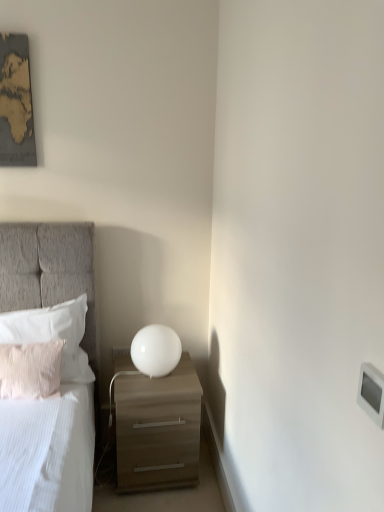
The width and height of the screenshot is (384, 512). What do you see at coordinates (156, 350) in the screenshot?
I see `white glossy sphere at center` at bounding box center [156, 350].

What is the approximate height of white glossy sphere at center?

white glossy sphere at center is 9.19 inches in height.

Image resolution: width=384 pixels, height=512 pixels. I want to click on matte wood drawer at lower left, so (x=157, y=444).

What is the approximate height of matte wood drawer at lower left?

matte wood drawer at lower left is 52.16 centimeters in height.

The width and height of the screenshot is (384, 512). In order to click on white plastic light switch at upper right in this screenshot , I will do `click(371, 393)`.

You are a GUI agent. You are given a task and a screenshot of the screen. Output one action in this format:
    pyautogui.click(x=<x>, y=<y>)
    Task: Click on the beige textured pillow at left, the second pillow from the back
    
    Given the screenshot: What is the action you would take?
    pyautogui.click(x=30, y=369)

Is point (113, 359) closer to viewer compared to point (161, 339)?

That is False.

From the image's perspective, is white plastic electric outlet at lower right above white glossy sphere at center?

No, from the image's perspective, white plastic electric outlet at lower right is not above white glossy sphere at center.

Considering the sizes of objects white plastic electric outlet at lower right and white glossy sphere at center in the image provided, who is shorter, white plastic electric outlet at lower right or white glossy sphere at center?

white plastic electric outlet at lower right.

How different are the orientations of white plastic electric outlet at lower right and white glossy sphere at center in degrees?

white plastic electric outlet at lower right and white glossy sphere at center are facing 0.726 degrees away from each other.

In the scene shown: From the image's perspective, which one is positioned lower, matte wood drawer at lower left or white soft pillow at left, placed as the first pillow when sorted from back to front?

matte wood drawer at lower left appears lower in the image.

Based on their positions, is matte wood drawer at lower left located to the left or right of white soft pillow at left, placed as the first pillow when sorted from back to front?

matte wood drawer at lower left is to the right of white soft pillow at left, placed as the first pillow when sorted from back to front.

Which is in front, matte wood drawer at lower left or white soft pillow at left, the 2th pillow from the front?

matte wood drawer at lower left.

How many degrees apart are the facing directions of matte wood drawer at lower left and white soft pillow at left, placed as the first pillow when sorted from back to front?

matte wood drawer at lower left and white soft pillow at left, placed as the first pillow when sorted from back to front, are facing 0.186 degrees away from each other.

Which object is more forward, white soft pillow at left, the 2th pillow from the front, or beige textured pillow at left, the second pillow from the back?

beige textured pillow at left, the second pillow from the back, is more forward.

This screenshot has height=512, width=384. In order to click on pillow above the beige textured pillow at left, which is the first pillow from front to back (from the image's perspective) in this screenshot , I will do `click(53, 334)`.

From their relative heights in the image, would you say white soft pillow at left, the 2th pillow from the front, is taller or shorter than beige textured pillow at left, the second pillow from the back?

white soft pillow at left, the 2th pillow from the front, is taller than beige textured pillow at left, the second pillow from the back.

Considering the relative positions of beige textured pillow at left, which is the first pillow from front to back, and white plastic electric outlet at lower right in the image provided, is beige textured pillow at left, which is the first pillow from front to back, to the left or to the right of white plastic electric outlet at lower right?

Clearly, beige textured pillow at left, which is the first pillow from front to back, is on the left of white plastic electric outlet at lower right in the image.

Is beige textured pillow at left, which is the first pillow from front to back, inside the boundaries of white plastic electric outlet at lower right, or outside?

beige textured pillow at left, which is the first pillow from front to back, lies outside white plastic electric outlet at lower right.

Identify the location of pillow that is the 2nd object to the left of the white plastic electric outlet at lower right, starting at the anchor. (30, 369).

Does beige textured pillow at left, which is the first pillow from front to back, touch white plastic electric outlet at lower right?

No, beige textured pillow at left, which is the first pillow from front to back, is not making contact with white plastic electric outlet at lower right.

Considering their positions, is beige textured pillow at left, which is the first pillow from front to back, located in front of or behind matte wood drawer at lower left?

Clearly, beige textured pillow at left, which is the first pillow from front to back, is in front of matte wood drawer at lower left.

Is point (54, 360) in front of point (134, 412)?

No, (54, 360) is behind (134, 412).

Consider the image. From the image's perspective, which is below, beige textured pillow at left, which is the first pillow from front to back, or matte wood drawer at lower left?

From the image's view, matte wood drawer at lower left is below.

Consider the image. Can you tell me how much white soft pillow at left, placed as the first pillow when sorted from back to front, and matte wood drawer at lower left differ in facing direction?

They differ by 0.186 degrees in their facing directions.

Considering the relative positions of white soft pillow at left, placed as the first pillow when sorted from back to front, and matte wood drawer at lower left in the image provided, is white soft pillow at left, placed as the first pillow when sorted from back to front, to the left of matte wood drawer at lower left from the viewer's perspective?

Yes.

Considering the points (76, 356) and (130, 434), which point is in front, point (76, 356) or point (130, 434)?

The point (130, 434) is more forward.

Is white soft pillow at left, the 2th pillow from the front, further to the viewer compared to matte wood drawer at lower left?

Yes.

Is white glossy sphere at center located outside beige textured pillow at left, which is the first pillow from front to back?

Absolutely, white glossy sphere at center is external to beige textured pillow at left, which is the first pillow from front to back.

Considering the relative sizes of white glossy sphere at center and beige textured pillow at left, the second pillow from the back, in the image provided, is white glossy sphere at center taller than beige textured pillow at left, the second pillow from the back,?

In fact, white glossy sphere at center may be shorter than beige textured pillow at left, the second pillow from the back.

Is point (167, 328) positioned before point (1, 387)?

No.

At what (x,y) coordinates should I click in order to perform the action: click on electric outlet that appears behind the white glossy sphere at center. Please return your answer as a coordinate pair (x, y). This screenshot has height=512, width=384. Looking at the image, I should click on (120, 352).

Where is `drawer to the right of white soft pillow at left, placed as the first pillow when sorted from back to front`? This screenshot has height=512, width=384. drawer to the right of white soft pillow at left, placed as the first pillow when sorted from back to front is located at coordinates pyautogui.click(x=157, y=444).

When comparing their distances from matte wood drawer at lower left, does white plastic electric outlet at lower right or white plastic light switch at upper right seem closer?

white plastic electric outlet at lower right lies closer to matte wood drawer at lower left than the other object.

From the image, which object appears to be nearer to white plastic electric outlet at lower right, matte wood drawer at lower left or white plastic light switch at upper right?

matte wood drawer at lower left.

From the image, which object appears to be nearer to matte wood drawer at lower left, beige textured pillow at left, the second pillow from the back, or white soft pillow at left, the 2th pillow from the front?

white soft pillow at left, the 2th pillow from the front, is positioned closer to the anchor matte wood drawer at lower left.

Which object lies nearer to the anchor point white soft pillow at left, the 2th pillow from the front, beige textured pillow at left, which is the first pillow from front to back, or matte wood drawer at lower left?

beige textured pillow at left, which is the first pillow from front to back, lies closer to white soft pillow at left, the 2th pillow from the front, than the other object.

From the image, which object appears to be nearer to matte wood drawer at lower left, white plastic electric outlet at lower right or beige textured pillow at left, the second pillow from the back?

beige textured pillow at left, the second pillow from the back, lies closer to matte wood drawer at lower left than the other object.

Based on the photo, estimate the real-world distances between objects in this image. Which object is further from white plastic light switch at upper right, white soft pillow at left, the 2th pillow from the front, or beige textured pillow at left, which is the first pillow from front to back?

white soft pillow at left, the 2th pillow from the front, is positioned further to the anchor white plastic light switch at upper right.

Considering their positions, is white glossy sphere at center positioned closer to matte wood drawer at lower left than white plastic light switch at upper right?

white glossy sphere at center is closer to matte wood drawer at lower left.

Considering their positions, is matte wood drawer at lower left positioned further to white plastic light switch at upper right than white glossy sphere at center?

matte wood drawer at lower left is positioned further to the anchor white plastic light switch at upper right.

Identify the location of pillow between beige textured pillow at left, the second pillow from the back, and white plastic electric outlet at lower right in the front-back direction. (53, 334).

Where is `table lamp between beige textured pillow at left, the second pillow from the back, and white plastic electric outlet at lower right, along the z-axis`? table lamp between beige textured pillow at left, the second pillow from the back, and white plastic electric outlet at lower right, along the z-axis is located at coordinates (156, 350).

Where is `drawer between beige textured pillow at left, the second pillow from the back, and white plastic electric outlet at lower right from front to back`? The height and width of the screenshot is (512, 384). drawer between beige textured pillow at left, the second pillow from the back, and white plastic electric outlet at lower right from front to back is located at coordinates (157, 444).

I want to click on pillow located between beige textured pillow at left, which is the first pillow from front to back, and white glossy sphere at center in the left-right direction, so click(53, 334).